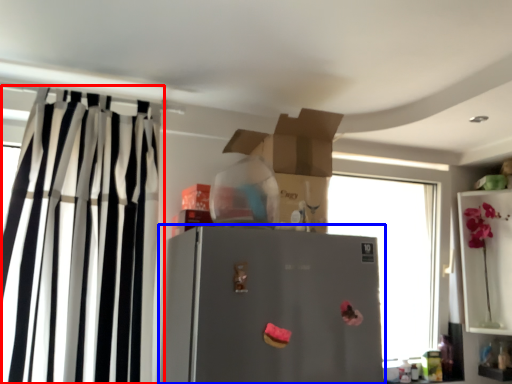
Question: Which of the following is the closest to the observer, curtain (highlighted by a red box) or refrigerator (highlighted by a blue box)?

Choices:
 (A) curtain
 (B) refrigerator

Answer: (B)